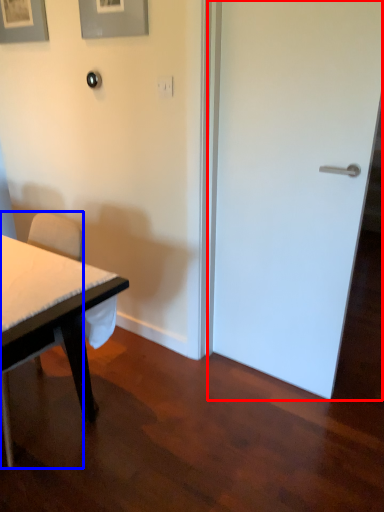
Question: Among these objects, which one is nearest to the camera, door (highlighted by a red box) or chair (highlighted by a blue box)?

Choices:
 (A) door
 (B) chair

Answer: (B)